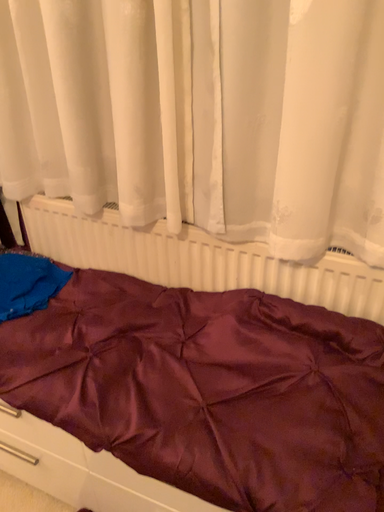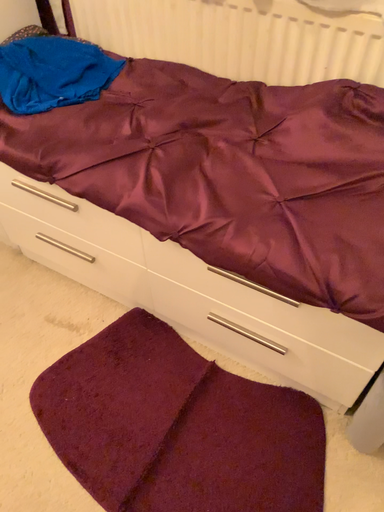
Question: Which way did the camera rotate in the video?

Choices:
 (A) rotated downward
 (B) rotated upward

Answer: (A)